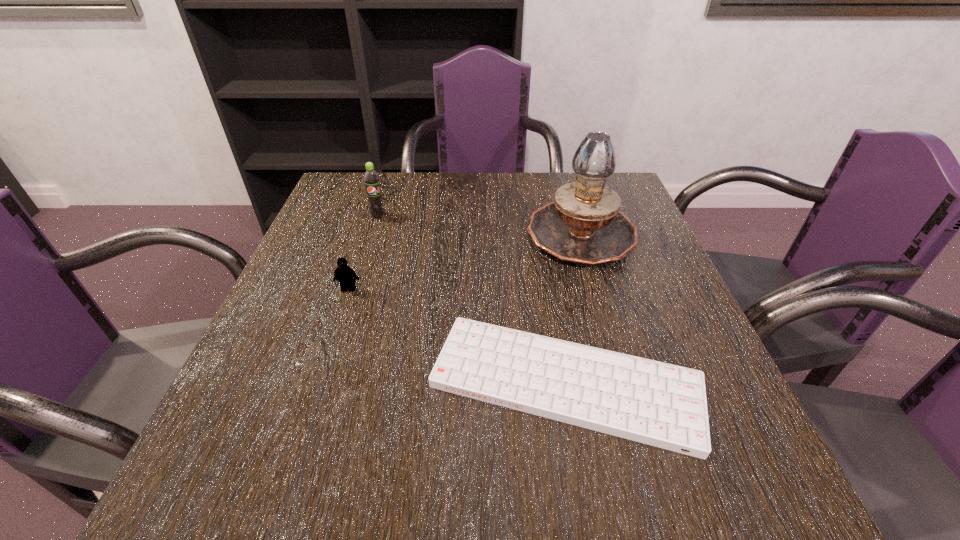
At what (x,y) coordinates should I click in order to perform the action: click on oil lamp that is at the far edge. Please return your answer as a coordinate pair (x, y). The height and width of the screenshot is (540, 960). Looking at the image, I should click on (583, 225).

Locate an element on the screen. The width and height of the screenshot is (960, 540). soda that is at the far edge is located at coordinates (371, 178).

Find the location of a particular element. The image size is (960, 540). object situated at the near edge is located at coordinates (663, 405).

You are a GUI agent. You are given a task and a screenshot of the screen. Output one action in this format:
    pyautogui.click(x=<x>, y=<y>)
    Task: Click on the soda that is at the left edge
    The width and height of the screenshot is (960, 540).
    Given the screenshot: What is the action you would take?
    pyautogui.click(x=371, y=178)

Locate an element on the screen. This screenshot has width=960, height=540. Lego located in the left edge section of the desktop is located at coordinates (344, 274).

Find the location of a particular element. oil lamp that is at the right edge is located at coordinates (583, 225).

Identify the location of computer keyboard that is at the right edge. Image resolution: width=960 pixels, height=540 pixels. (x=663, y=405).

Find the location of a particular element. Image resolution: width=960 pixels, height=540 pixels. object that is at the far left corner is located at coordinates (371, 178).

Image resolution: width=960 pixels, height=540 pixels. Find the location of `object present at the far right corner`. object present at the far right corner is located at coordinates (583, 225).

The height and width of the screenshot is (540, 960). I want to click on object at the near right corner, so click(663, 405).